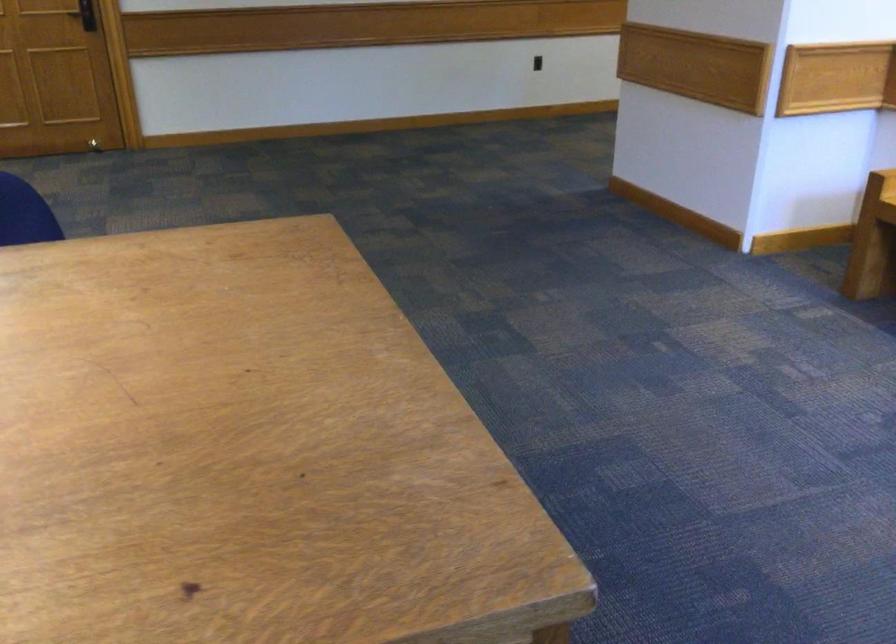
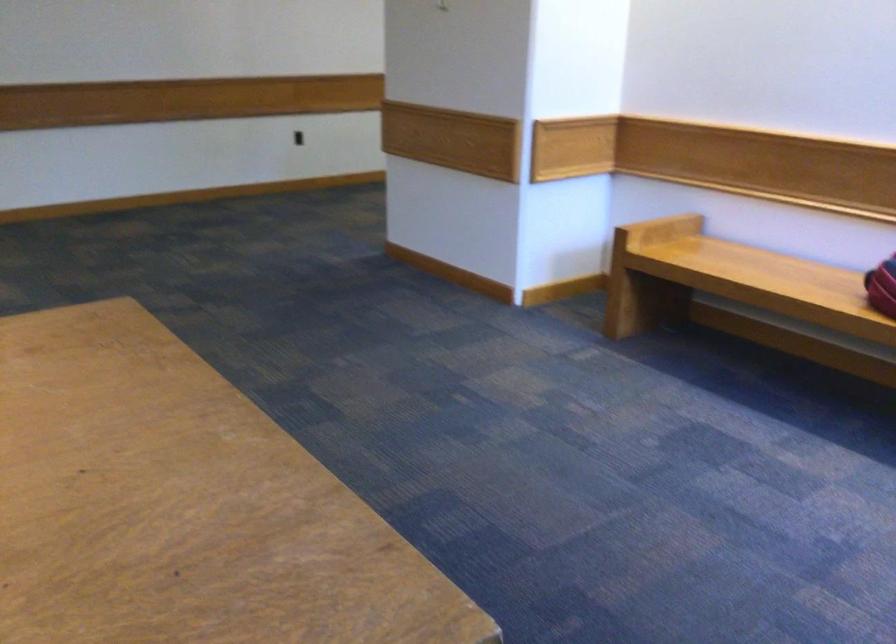
Question: The camera is either moving clockwise (left) or counter-clockwise (right) around the object. The first image is from the beginning of the video and the second image is from the end. Is the camera moving left or right when shooting the video?

Choices:
 (A) Left
 (B) Right

Answer: (A)